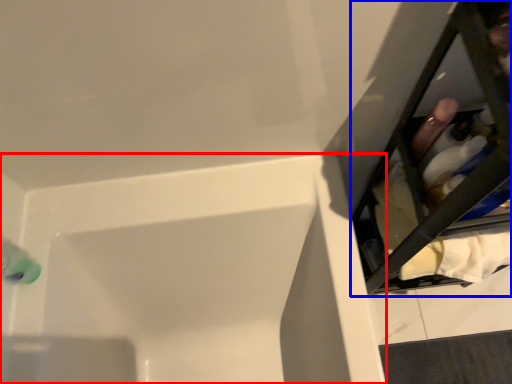
Question: Which object is further to the camera taking this photo, bathtub (highlighted by a red box) or furniture (highlighted by a blue box)?

Choices:
 (A) bathtub
 (B) furniture

Answer: (A)